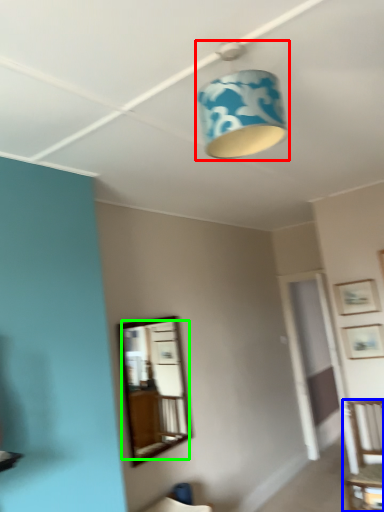
Question: Which object is the farthest from lamp (highlighted by a red box)? Choose among these: furniture (highlighted by a blue box) or mirror (highlighted by a green box).

Choices:
 (A) furniture
 (B) mirror

Answer: (B)